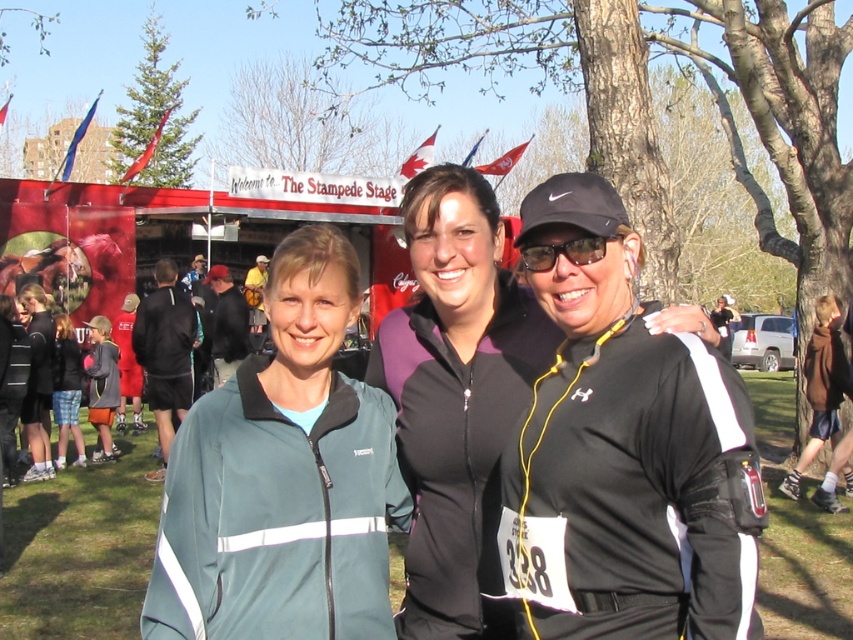
Who is lower down, dark gray jacket at center or black matte sunglasses at center?

dark gray jacket at center is below.

Does dark gray jacket at center have a smaller size compared to black matte sunglasses at center?

No, dark gray jacket at center is not smaller than black matte sunglasses at center.

Which is in front, point (216, 282) or point (572, 240)?

Positioned in front is point (572, 240).

Find the location of `dark gray jacket at center`. dark gray jacket at center is located at coordinates (227, 323).

Consider the image. Which is below, dark gray jacket at left or dark gray jacket at center?

dark gray jacket at left is lower down.

Who is positioned more to the left, dark gray jacket at left or dark gray jacket at center?

From the viewer's perspective, dark gray jacket at left appears more on the left side.

Identify the location of dark gray jacket at left. (165, 353).

Is dark gray jacket at left above green fabric jacket at left?

No.

Image resolution: width=853 pixels, height=640 pixels. Find the location of `dark gray jacket at left`. dark gray jacket at left is located at coordinates (165, 353).

Is point (132, 348) farther from camera compared to point (44, 339)?

Yes, point (132, 348) is behind point (44, 339).

I want to click on dark gray jacket at left, so click(165, 353).